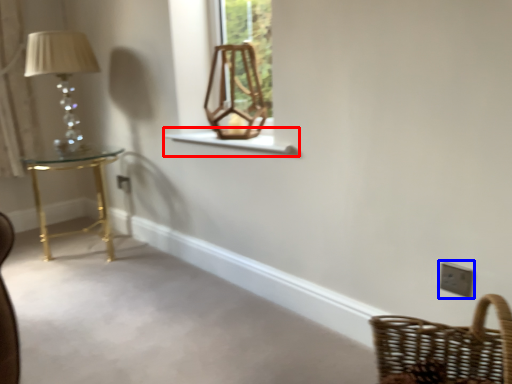
Question: Which object is closer to the camera taking this photo, window sill (highlighted by a red box) or light switch (highlighted by a blue box)?

Choices:
 (A) window sill
 (B) light switch

Answer: (B)